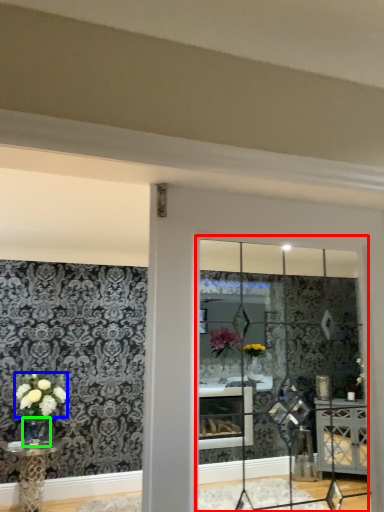
Question: Based on their relative distances, which object is farther from glass window (highlighted by a red box)? Choose from flower (highlighted by a blue box) and glass vase (highlighted by a green box).

Choices:
 (A) flower
 (B) glass vase

Answer: (B)